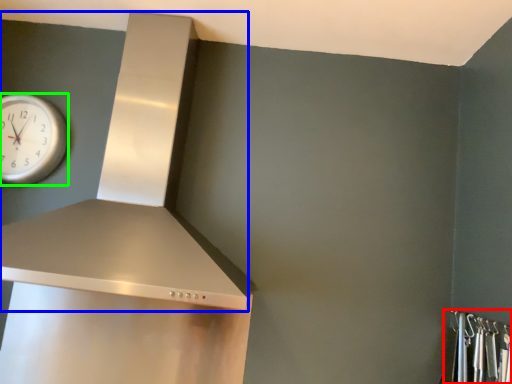
Question: Which object is positioned closest to closet (highlighted by a red box)? Select from vent (highlighted by a blue box) and wall clock (highlighted by a green box).

Choices:
 (A) vent
 (B) wall clock

Answer: (A)